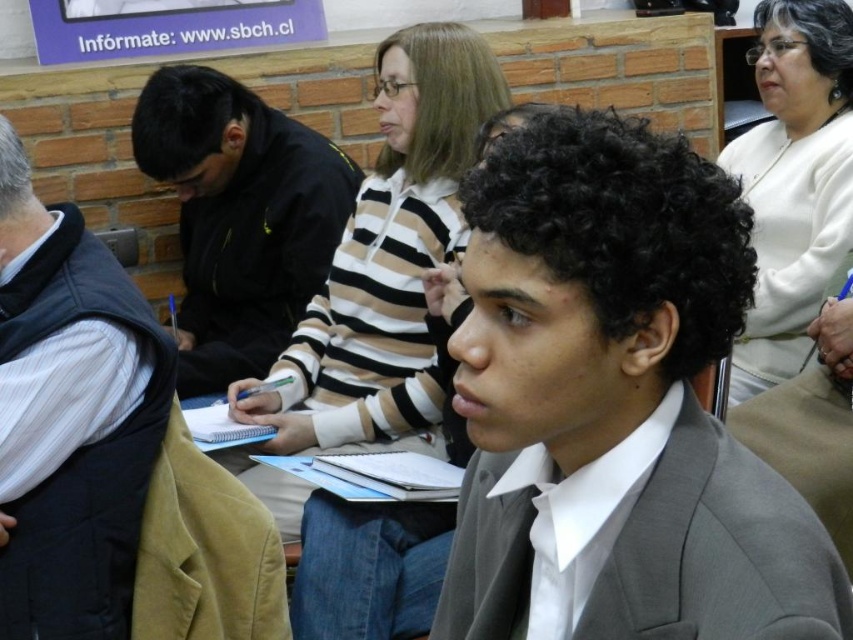
Question: Is matte gray suit at center thinner than striped sweater at center?

Choices:
 (A) no
 (B) yes

Answer: (B)

Question: Does striped sweater at center appear under white soft sweater at upper right?

Choices:
 (A) no
 (B) yes

Answer: (B)

Question: Is dark gray vest at left thinner than black jacket at center?

Choices:
 (A) yes
 (B) no

Answer: (A)

Question: Which point is closer to the camera taking this photo?

Choices:
 (A) (444, 44)
 (B) (740, 340)
 (C) (96, 291)
 (D) (175, 168)

Answer: (C)

Question: Which object is farther from the camera taking this photo?

Choices:
 (A) black jacket at center
 (B) striped sweater at center
 (C) dark gray vest at left
 (D) white soft sweater at upper right

Answer: (A)

Question: Which of these objects is positioned farthest from the white soft sweater at upper right?

Choices:
 (A) striped sweater at center
 (B) matte gray suit at center
 (C) black jacket at center

Answer: (B)